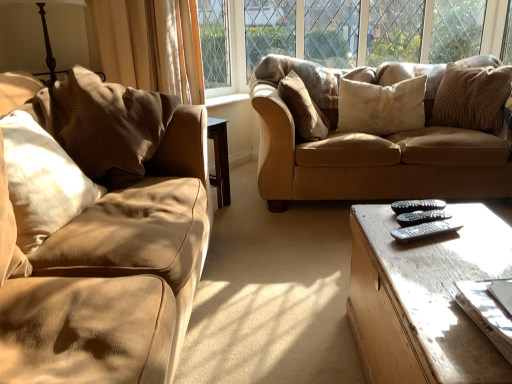
In order to click on free location to the right of black plastic remote at center, positioned as the third remote in front-to-back order in this screenshot , I will do `click(468, 211)`.